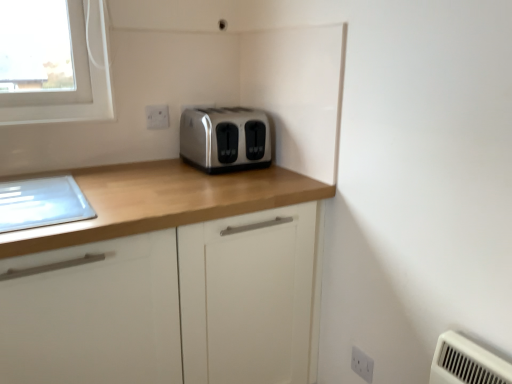
Question: Considering the relative positions of white plastic electric outlet at lower right, acting as the 1th electric outlet starting from the right, and white plastic electric outlet at upper center, which is the 2th electric outlet in bottom-to-top order, in the image provided, is white plastic electric outlet at lower right, acting as the 1th electric outlet starting from the right, to the right of white plastic electric outlet at upper center, which is the 2th electric outlet in bottom-to-top order, from the viewer's perspective?

Choices:
 (A) no
 (B) yes

Answer: (B)

Question: Is white plastic electric outlet at lower right, arranged as the 1th electric outlet when viewed from the front, smaller than white plastic electric outlet at upper center, the 1th electric outlet when ordered from back to front?

Choices:
 (A) no
 (B) yes

Answer: (A)

Question: Could you tell me if white plastic electric outlet at lower right, which is counted as the 2th electric outlet, starting from the left, is facing white plastic electric outlet at upper center, the 1th electric outlet when ordered from back to front?

Choices:
 (A) yes
 (B) no

Answer: (B)

Question: Does white plastic electric outlet at lower right, acting as the 1th electric outlet starting from the right, have a lesser width compared to white plastic electric outlet at upper center, the 1th electric outlet when ordered from back to front?

Choices:
 (A) yes
 (B) no

Answer: (B)

Question: Can we say white plastic electric outlet at lower right, which appears as the second electric outlet when viewed from the top, lies outside white plastic electric outlet at upper center, which is counted as the 2th electric outlet, starting from the right?

Choices:
 (A) yes
 (B) no

Answer: (A)

Question: Considering the positions of white plastic electric outlet at lower right, which is counted as the 2th electric outlet, starting from the left, and matte wood cabinet at center in the image, is white plastic electric outlet at lower right, which is counted as the 2th electric outlet, starting from the left, taller or shorter than matte wood cabinet at center?

Choices:
 (A) tall
 (B) short

Answer: (B)

Question: Based on their sizes in the image, would you say white plastic electric outlet at lower right, the 2th electric outlet in the back-to-front sequence, is bigger or smaller than matte wood cabinet at center?

Choices:
 (A) big
 (B) small

Answer: (B)

Question: From a real-world perspective, is white plastic electric outlet at lower right, the 2th electric outlet in the back-to-front sequence, physically located above or below matte wood cabinet at center?

Choices:
 (A) below
 (B) above

Answer: (A)

Question: Is white plastic electric outlet at lower right, positioned as the 1th electric outlet in bottom-to-top order, wider or thinner than matte wood cabinet at center?

Choices:
 (A) thin
 (B) wide

Answer: (A)

Question: Considering the positions of matte wood cabinet at center and white plastic electric outlet at upper center, acting as the first electric outlet starting from the top, in the image, is matte wood cabinet at center bigger or smaller than white plastic electric outlet at upper center, acting as the first electric outlet starting from the top,?

Choices:
 (A) small
 (B) big

Answer: (B)

Question: Considering the relative positions of matte wood cabinet at center and white plastic electric outlet at upper center, positioned as the 1th electric outlet in left-to-right order, in the image provided, is matte wood cabinet at center to the left or to the right of white plastic electric outlet at upper center, positioned as the 1th electric outlet in left-to-right order,?

Choices:
 (A) right
 (B) left

Answer: (A)

Question: Would you say matte wood cabinet at center is inside or outside white plastic electric outlet at upper center, which is the 2th electric outlet in bottom-to-top order?

Choices:
 (A) outside
 (B) inside

Answer: (A)

Question: From a real-world perspective, is matte wood cabinet at center positioned above or below white plastic electric outlet at upper center, acting as the first electric outlet starting from the top?

Choices:
 (A) above
 (B) below

Answer: (B)

Question: Is white plastic electric outlet at upper center, which is counted as the 2th electric outlet, starting from the right, inside or outside of white plastic electric outlet at lower right, arranged as the 1th electric outlet when viewed from the front?

Choices:
 (A) outside
 (B) inside

Answer: (A)

Question: Does point (150, 119) appear closer or farther from the camera than point (366, 380)?

Choices:
 (A) closer
 (B) farther

Answer: (B)